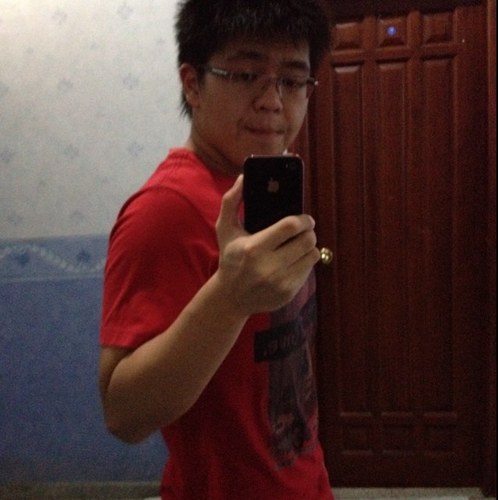
The height and width of the screenshot is (500, 498). In order to click on door in this screenshot , I will do `click(418, 246)`.